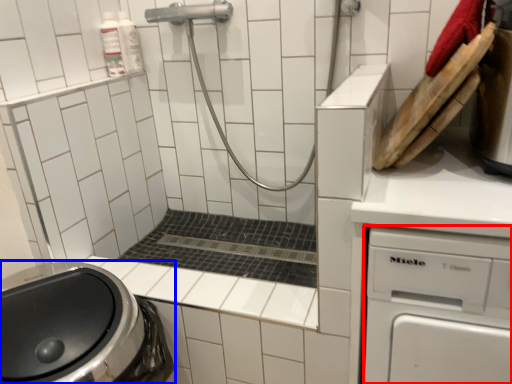
Question: Which point is closer to the camera, dish washer (highlighted by a red box) or washing machine (highlighted by a blue box)?

Choices:
 (A) dish washer
 (B) washing machine

Answer: (A)